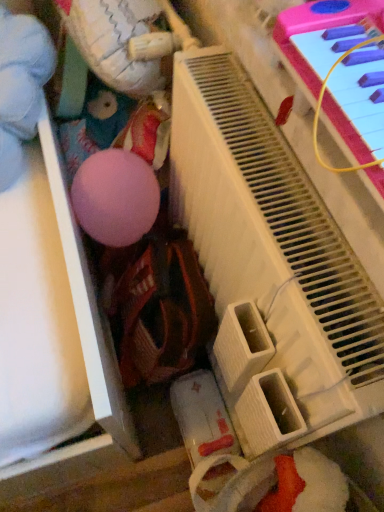
Question: Considering the positions of white matte plush at upper left, the second toy from the left, and pink plastic piano at upper right in the image, is white matte plush at upper left, the second toy from the left, bigger or smaller than pink plastic piano at upper right?

Choices:
 (A) small
 (B) big

Answer: (A)

Question: Is point (91, 33) positioned closer to the camera than point (284, 378)?

Choices:
 (A) farther
 (B) closer

Answer: (A)

Question: Estimate the real-world distances between objects in this image. Which object is closer to the matte pink ball at upper left, the 1th toy positioned from the left?

Choices:
 (A) pink plastic piano at upper right
 (B) white matte plush at upper left, the second toy from the left

Answer: (B)

Question: Estimate the real-world distances between objects in this image. Which object is closer to the pink plastic piano at upper right?

Choices:
 (A) white matte plush at upper left, the second toy from the left
 (B) matte pink ball at upper left, the 1th toy positioned from the left

Answer: (A)